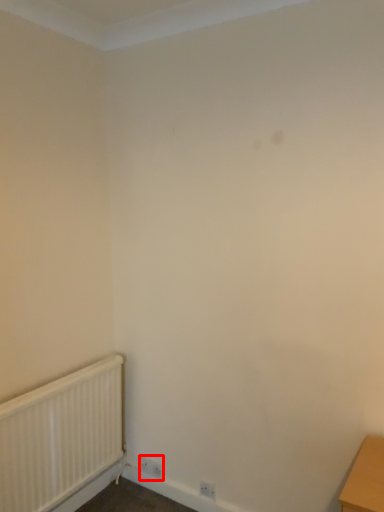
Question: From the image, what is the correct spatial relationship of electric outlet (annotated by the red box) in relation to radiator?

Choices:
 (A) right
 (B) left

Answer: (A)